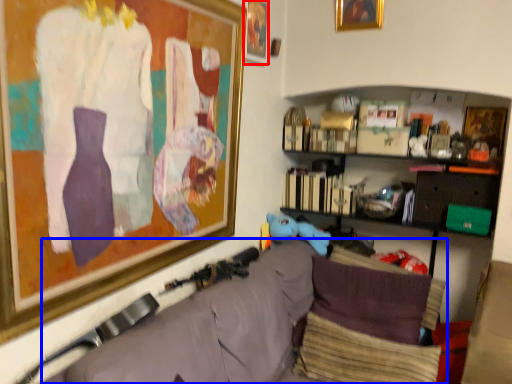
Question: Among these objects, which one is farthest to the camera, picture frame (highlighted by a red box) or couch (highlighted by a blue box)?

Choices:
 (A) picture frame
 (B) couch

Answer: (A)